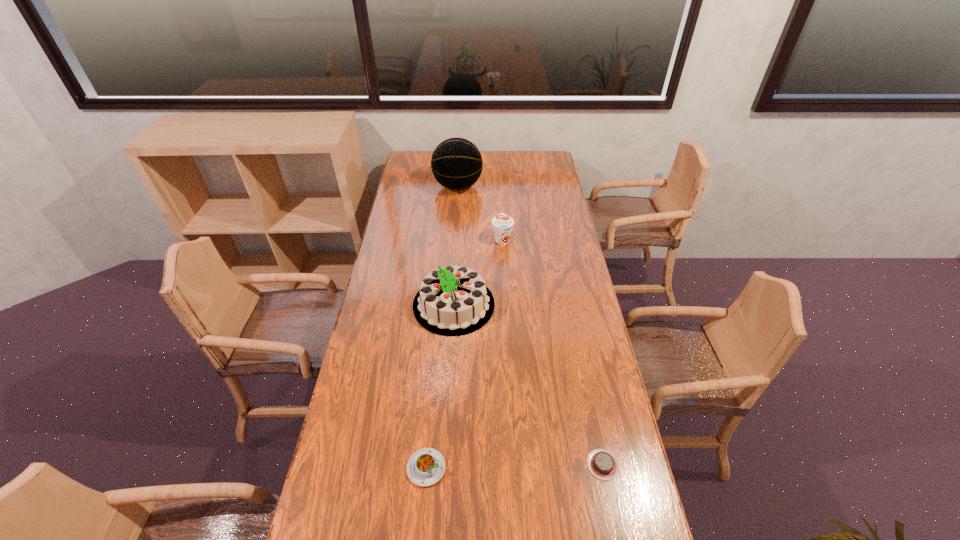
The width and height of the screenshot is (960, 540). I want to click on free region located on the right of the third farthest object, so click(x=537, y=305).

Locate an element on the screen. The height and width of the screenshot is (540, 960). free space located on the right of the yogurt is located at coordinates (531, 239).

At what (x,y) coordinates should I click in order to perform the action: click on free point located on the back of the second shortest object. Please return your answer as a coordinate pair (x, y). Image resolution: width=960 pixels, height=540 pixels. Looking at the image, I should click on (430, 421).

Find the location of a particular element. Image resolution: width=960 pixels, height=540 pixels. vacant space situated on the front of the chocolate cake is located at coordinates (612, 508).

Where is `object at the right edge`? The width and height of the screenshot is (960, 540). object at the right edge is located at coordinates (602, 464).

In order to click on free region at the far edge of the desktop in this screenshot , I will do `click(511, 162)`.

In order to click on vacant region at the left edge of the desktop in this screenshot , I will do `click(380, 279)`.

This screenshot has width=960, height=540. What are the coordinates of `vacant space at the right edge` in the screenshot? It's located at (560, 247).

Find the location of `free space between the second shortest object and the second farthest object`. free space between the second shortest object and the second farthest object is located at coordinates (465, 354).

The height and width of the screenshot is (540, 960). In order to click on vacant space that's between the pudding and the birthday cake in this screenshot , I will do `click(440, 386)`.